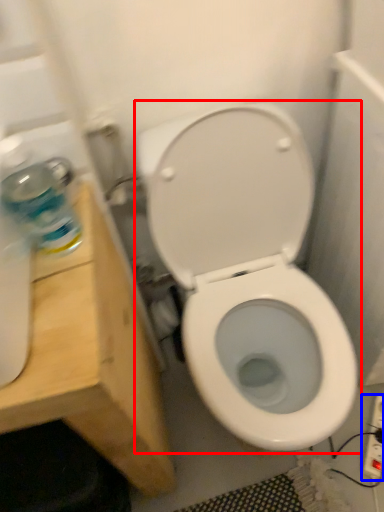
Question: Which point is closer to the camera, toilet (highlighted by a red box) or electric outlet (highlighted by a blue box)?

Choices:
 (A) toilet
 (B) electric outlet

Answer: (A)